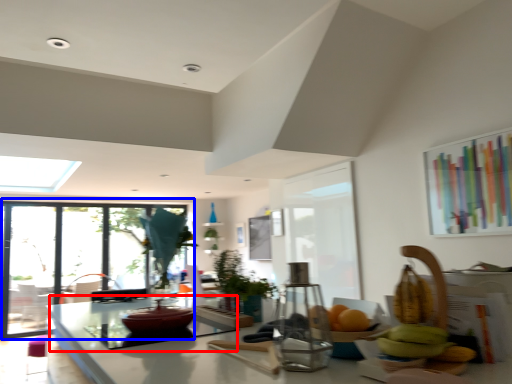
Question: Among these objects, which one is farthest to the camera, glass table (highlighted by a red box) or window (highlighted by a blue box)?

Choices:
 (A) glass table
 (B) window

Answer: (B)